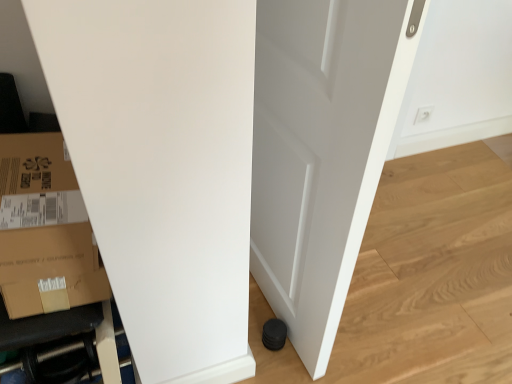
This screenshot has height=384, width=512. Identify the location of vacant space to the right of white matte door at center. (386, 312).